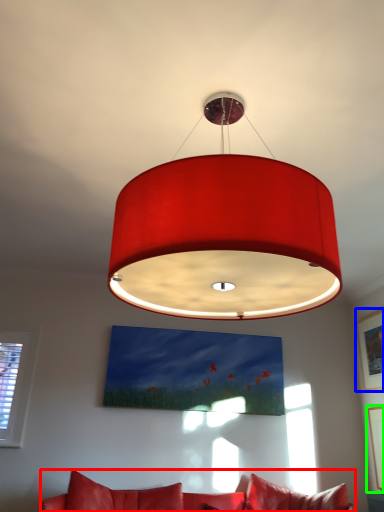
Question: Considering the real-world distances, which object is farthest from studio couch (highlighted by a red box)? picture frame (highlighted by a blue box) or picture frame (highlighted by a green box)?

Choices:
 (A) picture frame
 (B) picture frame

Answer: (A)